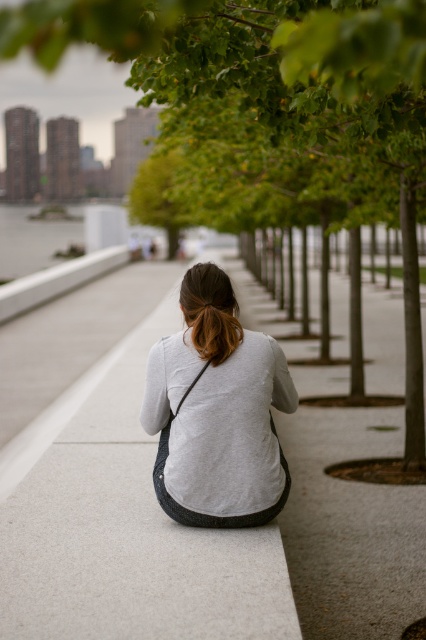
Question: Considering the relative positions of smooth concrete bench at center and white concrete curb at center in the image provided, where is smooth concrete bench at center located with respect to white concrete curb at center?

Choices:
 (A) below
 (B) above

Answer: (A)

Question: Estimate the real-world distances between objects in this image. Which object is farther from the smooth concrete bench at center?

Choices:
 (A) green leafy tree at center
 (B) golden brown hair at center
 (C) gray cotton shirt at center

Answer: (A)

Question: Is gray cotton shirt at center wider than white concrete curb at center?

Choices:
 (A) no
 (B) yes

Answer: (A)

Question: Estimate the real-world distances between objects in this image. Which object is closer to the golden brown hair at center?

Choices:
 (A) gray cotton shirt at center
 (B) green leafy tree at center
 (C) smooth concrete bench at center
 (D) white concrete curb at center

Answer: (A)

Question: Estimate the real-world distances between objects in this image. Which object is closer to the gray cotton shirt at center?

Choices:
 (A) golden brown hair at center
 (B) white concrete curb at center

Answer: (A)

Question: Can you confirm if green leafy tree at center is positioned to the left of white concrete curb at center?

Choices:
 (A) yes
 (B) no

Answer: (B)